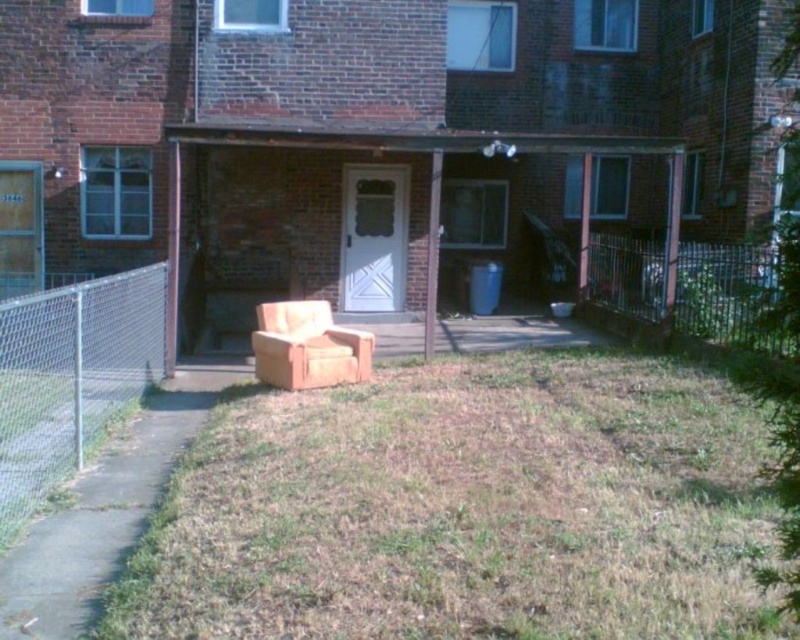
Question: Can you confirm if metal chain-link fence at left is bigger than metallic chain-link fence at right?

Choices:
 (A) yes
 (B) no

Answer: (A)

Question: Is metal chain-link fence at left further to the viewer compared to beige fabric chair at center?

Choices:
 (A) no
 (B) yes

Answer: (A)

Question: Which of the following is the farthest from the observer?

Choices:
 (A) (318, 365)
 (B) (633, 252)
 (C) (114, 396)

Answer: (B)

Question: Can you confirm if metal chain-link fence at left is positioned to the right of beige fabric chair at center?

Choices:
 (A) no
 (B) yes

Answer: (A)

Question: Among these points, which one is nearest to the camera?

Choices:
 (A) (278, 340)
 (B) (80, 380)
 (C) (646, 317)

Answer: (B)

Question: Which point is farther to the camera?

Choices:
 (A) metallic chain-link fence at right
 (B) metal chain-link fence at left
 (C) beige fabric chair at center

Answer: (C)